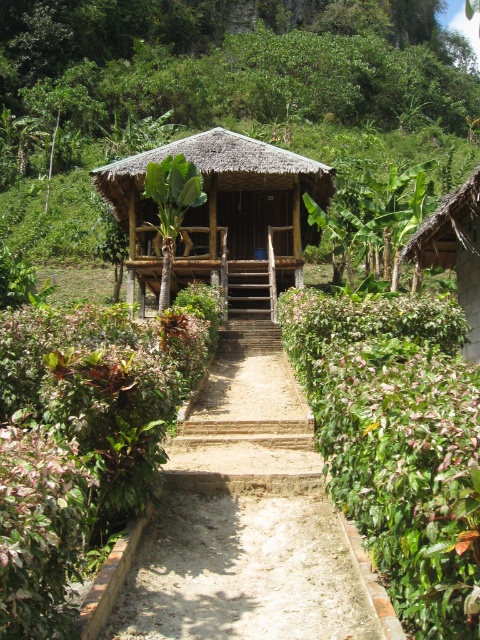
Can you confirm if brown gravel path at center is smaller than thatched roof hut at right?

No.

Does brown gravel path at center have a greater width compared to thatched roof hut at right?

Yes.

Describe the element at coordinates (243, 518) in the screenshot. I see `brown gravel path at center` at that location.

You are a GUI agent. You are given a task and a screenshot of the screen. Output one action in this format:
    pyautogui.click(x=<x>, y=<y>)
    Task: Click on the brown gravel path at center
    The height and width of the screenshot is (640, 480).
    Given the screenshot: What is the action you would take?
    pyautogui.click(x=243, y=518)

Between brown gravel path at center and thatched bamboo hut at center, which one has more height?

thatched bamboo hut at center is taller.

Is point (265, 321) more distant than point (299, 205)?

No.

The image size is (480, 640). Find the location of `brown gravel path at center`. brown gravel path at center is located at coordinates (243, 518).

Is thatched bamboo hut at center smaller than thatched roof hut at right?

No, thatched bamboo hut at center is not smaller than thatched roof hut at right.

Can you confirm if thatched bamboo hut at center is positioned above thatched roof hut at right?

Indeed, thatched bamboo hut at center is positioned over thatched roof hut at right.

This screenshot has height=640, width=480. What do you see at coordinates (220, 216) in the screenshot?
I see `thatched bamboo hut at center` at bounding box center [220, 216].

Locate an element on the screen. This screenshot has height=640, width=480. thatched bamboo hut at center is located at coordinates (220, 216).